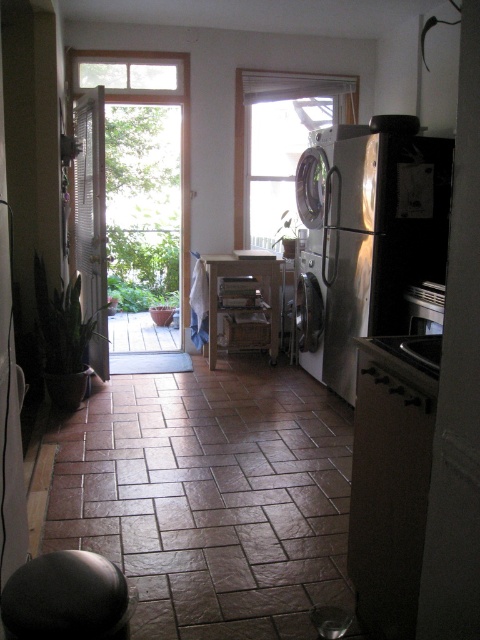
Who is taller, clear glass door at left or satin silver dishwasher at center?

With more height is clear glass door at left.

Can you confirm if clear glass door at left is wider than satin silver dishwasher at center?

Yes, clear glass door at left is wider than satin silver dishwasher at center.

The width and height of the screenshot is (480, 640). What do you see at coordinates (137, 205) in the screenshot?
I see `clear glass door at left` at bounding box center [137, 205].

Image resolution: width=480 pixels, height=640 pixels. Find the location of `clear glass door at left`. clear glass door at left is located at coordinates (137, 205).

Is brown stone tile at lower center positioned before black matte stool at lower left?

No, brown stone tile at lower center is further to the viewer.

Is brown stone tile at lower center positioned at the back of black matte stool at lower left?

Yes, it is.

Who is more forward, (x=158, y=449) or (x=74, y=595)?

Point (x=74, y=595) is more forward.

Where is `brown stone tile at lower center`? This screenshot has width=480, height=640. brown stone tile at lower center is located at coordinates (211, 497).

Does black matte stool at lower left have a smaller size compared to satin silver dishwasher at center?

Indeed, black matte stool at lower left has a smaller size compared to satin silver dishwasher at center.

Is black matte stool at lower left positioned before satin silver dishwasher at center?

Yes, it is.

Locate an element on the screen. black matte stool at lower left is located at coordinates (68, 598).